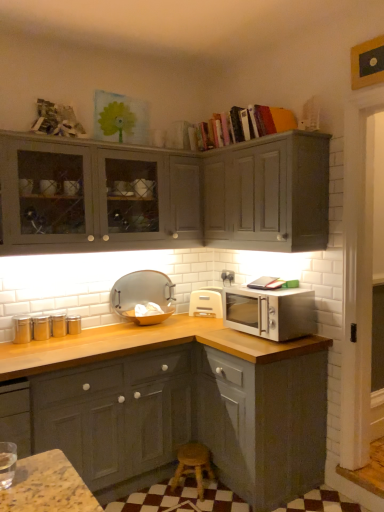
You are a GUI agent. You are given a task and a screenshot of the screen. Output one action in this format:
    pyautogui.click(x=<x>, y=<y>)
    Task: Click on the hardcover books at upper center
    This screenshot has width=384, height=512.
    Given the screenshot: What is the action you would take?
    pyautogui.click(x=241, y=126)

Describe the element at coordinates (118, 414) in the screenshot. I see `matte gray cabinets at lower left, the 1th cabinetry from the bottom` at that location.

In the scene shown: Measure the distance between point (93, 180) and camera.

Point (93, 180) is 8.49 feet away from camera.

Find the location of a particular element. matte gray cabinets at upper left, arranged as the second cabinetry when viewed from the top is located at coordinates (173, 197).

Locate an element on the screen. white plastic toaster at lower right, the 1th appliance from the right is located at coordinates (206, 303).

Image resolution: width=384 pixels, height=512 pixels. What do you see at coordinates (206, 303) in the screenshot?
I see `white plastic toaster at lower right, which appears as the second appliance when viewed from the left` at bounding box center [206, 303].

Locate an element on the screen. This screenshot has width=384, height=512. hardcover books at upper center is located at coordinates (241, 126).

Can hardcover books at upper center be found inside satin silver microwave at right?

No, hardcover books at upper center is not surrounded by satin silver microwave at right.

From a real-world perspective, which is physically above, satin silver microwave at right or hardcover books at upper center?

hardcover books at upper center is physically above.

From the image's perspective, between satin silver microwave at right and hardcover books at upper center, who is located below?

satin silver microwave at right appears lower in the image.

Between satin silver microwave at right and hardcover books at upper center, which one has smaller size?

Smaller between the two is satin silver microwave at right.

Consider the image. Considering the relative sizes of wooden at lower center and white plastic toaster at lower right, which appears as the second appliance when viewed from the left, in the image provided, is wooden at lower center bigger than white plastic toaster at lower right, which appears as the second appliance when viewed from the left,?

Yes.

Is wooden at lower center oriented away from white plastic toaster at lower right, which appears as the second appliance when viewed from the left?

wooden at lower center is not turned away from white plastic toaster at lower right, which appears as the second appliance when viewed from the left.

Does point (187, 455) come in front of point (198, 314)?

Yes, it is in front of point (198, 314).

Can you tell me how much matte silver tray at center, marked as the second appliance in a right-to-left arrangement, and satin silver microwave at right differ in facing direction?

There is a 88-degree angle between the facing directions of matte silver tray at center, marked as the second appliance in a right-to-left arrangement, and satin silver microwave at right.

Considering the positions of objects matte silver tray at center, the 1th appliance when ordered from left to right, and satin silver microwave at right in the image provided, who is behind, matte silver tray at center, the 1th appliance when ordered from left to right, or satin silver microwave at right?

Positioned behind is matte silver tray at center, the 1th appliance when ordered from left to right.

From a real-world perspective, does matte silver tray at center, marked as the second appliance in a right-to-left arrangement, stand above satin silver microwave at right?

Yes, from a real-world perspective, matte silver tray at center, marked as the second appliance in a right-to-left arrangement, is over satin silver microwave at right

Considering the sizes of objects matte silver tray at center, the 1th appliance when ordered from left to right, and satin silver microwave at right in the image provided, who is bigger, matte silver tray at center, the 1th appliance when ordered from left to right, or satin silver microwave at right?

Bigger between the two is satin silver microwave at right.

From a real-world perspective, does matte gray cabinet at upper right, arranged as the first cabinetry when viewed from the top, stand above matte silver tray at center, the 1th appliance when ordered from left to right?

Yes, from a real-world perspective, matte gray cabinet at upper right, arranged as the first cabinetry when viewed from the top, is on top of matte silver tray at center, the 1th appliance when ordered from left to right.

In the image, is matte gray cabinet at upper right, acting as the third cabinetry starting from the bottom, positioned in front of or behind matte silver tray at center, marked as the second appliance in a right-to-left arrangement?

matte gray cabinet at upper right, acting as the third cabinetry starting from the bottom, is positioned closer to the viewer than matte silver tray at center, marked as the second appliance in a right-to-left arrangement.

Can matte silver tray at center, marked as the second appliance in a right-to-left arrangement, be found inside matte gray cabinet at upper right, arranged as the first cabinetry when viewed from the top?

No.

From the image's perspective, would you say matte gray cabinet at upper right, arranged as the first cabinetry when viewed from the top, is shown under matte silver tray at center, the 1th appliance when ordered from left to right?

Actually, matte gray cabinet at upper right, arranged as the first cabinetry when viewed from the top, appears above matte silver tray at center, the 1th appliance when ordered from left to right, in the image.

Considering the sizes of matte gray cabinets at lower left, the 1th cabinetry from the bottom, and matte gray cabinets at upper left, the second cabinetry positioned from the bottom, in the image, is matte gray cabinets at lower left, the 1th cabinetry from the bottom, taller or shorter than matte gray cabinets at upper left, the second cabinetry positioned from the bottom,?

In the image, matte gray cabinets at lower left, the 1th cabinetry from the bottom, appears to be taller than matte gray cabinets at upper left, the second cabinetry positioned from the bottom.

Is matte gray cabinets at upper left, the second cabinetry positioned from the bottom, inside matte gray cabinets at lower left, acting as the third cabinetry starting from the top?

No, matte gray cabinets at lower left, acting as the third cabinetry starting from the top, does not contain matte gray cabinets at upper left, the second cabinetry positioned from the bottom.

From a real-world perspective, between matte gray cabinets at lower left, acting as the third cabinetry starting from the top, and matte gray cabinets at upper left, the second cabinetry positioned from the bottom, who is vertically lower?

matte gray cabinets at lower left, acting as the third cabinetry starting from the top, from a real-world perspective.

In the scene shown: Is matte gray cabinets at upper left, arranged as the second cabinetry when viewed from the top, facing away from hardcover books at upper center?

That's not correct — matte gray cabinets at upper left, arranged as the second cabinetry when viewed from the top, is not looking away from hardcover books at upper center.

From the image's perspective, who appears lower, matte gray cabinets at upper left, arranged as the second cabinetry when viewed from the top, or hardcover books at upper center?

matte gray cabinets at upper left, arranged as the second cabinetry when viewed from the top, from the image's perspective.

Which object is thinner, matte gray cabinets at upper left, arranged as the second cabinetry when viewed from the top, or hardcover books at upper center?

Thinner between the two is hardcover books at upper center.

Can we say matte gray cabinets at upper left, the second cabinetry positioned from the bottom, lies outside hardcover books at upper center?

matte gray cabinets at upper left, the second cabinetry positioned from the bottom, lies outside hardcover books at upper center's area.

Which object is closer to the camera, matte gray cabinets at upper left, arranged as the second cabinetry when viewed from the top, or matte silver tray at center, marked as the second appliance in a right-to-left arrangement?

matte gray cabinets at upper left, arranged as the second cabinetry when viewed from the top, is in front.

Based on the photo, does matte gray cabinets at upper left, the second cabinetry positioned from the bottom, have a greater width compared to matte silver tray at center, the 1th appliance when ordered from left to right?

Correct, the width of matte gray cabinets at upper left, the second cabinetry positioned from the bottom, exceeds that of matte silver tray at center, the 1th appliance when ordered from left to right.

Considering the relative sizes of matte gray cabinets at upper left, the second cabinetry positioned from the bottom, and matte silver tray at center, the 1th appliance when ordered from left to right, in the image provided, is matte gray cabinets at upper left, the second cabinetry positioned from the bottom, smaller than matte silver tray at center, the 1th appliance when ordered from left to right,?

Actually, matte gray cabinets at upper left, the second cabinetry positioned from the bottom, might be larger than matte silver tray at center, the 1th appliance when ordered from left to right.

Image resolution: width=384 pixels, height=512 pixels. Find the location of `book behind the satin silver microwave at right`. book behind the satin silver microwave at right is located at coordinates (241, 126).

In order to click on appliance that is the 1st object above the wooden at lower center (from a real-world perspective) in this screenshot , I will do `click(206, 303)`.

Based on their spatial positions, is wooden at lower center or matte silver tray at center, marked as the second appliance in a right-to-left arrangement, closer to satin silver microwave at right?

matte silver tray at center, marked as the second appliance in a right-to-left arrangement, lies closer to satin silver microwave at right than the other object.

When comparing their distances from matte gray cabinets at lower left, acting as the third cabinetry starting from the top, does matte silver tray at center, the 1th appliance when ordered from left to right, or wooden at lower center seem closer?

Among the two, wooden at lower center is located nearer to matte gray cabinets at lower left, acting as the third cabinetry starting from the top.

From the image, which object appears to be farther from matte gray cabinets at upper left, the second cabinetry positioned from the bottom, matte gray cabinets at lower left, acting as the third cabinetry starting from the top, or hardcover books at upper center?

Among the two, matte gray cabinets at lower left, acting as the third cabinetry starting from the top, is located further to matte gray cabinets at upper left, the second cabinetry positioned from the bottom.

Looking at the image, which one is located further to wooden at lower center, matte gray cabinets at lower left, the 1th cabinetry from the bottom, or matte gray cabinets at upper left, the second cabinetry positioned from the bottom?

Based on the image, matte gray cabinets at upper left, the second cabinetry positioned from the bottom, appears to be further to wooden at lower center.

When comparing their distances from matte gray cabinet at upper right, arranged as the first cabinetry when viewed from the top, does wooden at lower center or matte gray cabinets at lower left, acting as the third cabinetry starting from the top, seem further?

The object further to matte gray cabinet at upper right, arranged as the first cabinetry when viewed from the top, is wooden at lower center.

Which object lies further to the anchor point matte gray cabinet at upper right, acting as the third cabinetry starting from the bottom, matte silver tray at center, marked as the second appliance in a right-to-left arrangement, or satin silver microwave at right?

Among the two, matte silver tray at center, marked as the second appliance in a right-to-left arrangement, is located further to matte gray cabinet at upper right, acting as the third cabinetry starting from the bottom.

Considering their positions, is hardcover books at upper center positioned further to white plastic toaster at lower right, which appears as the second appliance when viewed from the left, than matte gray cabinets at upper left, the second cabinetry positioned from the bottom?

hardcover books at upper center is positioned further to the anchor white plastic toaster at lower right, which appears as the second appliance when viewed from the left.

From the image, which object appears to be nearer to matte gray cabinets at upper left, the second cabinetry positioned from the bottom, satin silver microwave at right or white plastic toaster at lower right, the 1th appliance from the right?

Among the two, satin silver microwave at right is located nearer to matte gray cabinets at upper left, the second cabinetry positioned from the bottom.

What are the coordinates of `microwave oven between hardcover books at upper center and matte gray cabinets at lower left, the 1th cabinetry from the bottom, in the up-down direction` in the screenshot? It's located at (270, 312).

Where is `appliance positioned between matte gray cabinet at upper right, acting as the third cabinetry starting from the bottom, and white plastic toaster at lower right, which appears as the second appliance when viewed from the left, from near to far`? appliance positioned between matte gray cabinet at upper right, acting as the third cabinetry starting from the bottom, and white plastic toaster at lower right, which appears as the second appliance when viewed from the left, from near to far is located at coordinates (142, 295).

You are a GUI agent. You are given a task and a screenshot of the screen. Output one action in this format:
    pyautogui.click(x=<x>, y=<y>)
    Task: Click on the book between matte gray cabinets at upper left, the second cabinetry positioned from the bottom, and matte gray cabinet at upper right, arranged as the first cabinetry when viewed from the top
    
    Given the screenshot: What is the action you would take?
    pyautogui.click(x=241, y=126)

In order to click on microwave oven positioned between matte gray cabinet at upper right, acting as the third cabinetry starting from the bottom, and white plastic toaster at lower right, the 1th appliance from the right, from near to far in this screenshot , I will do (270, 312).